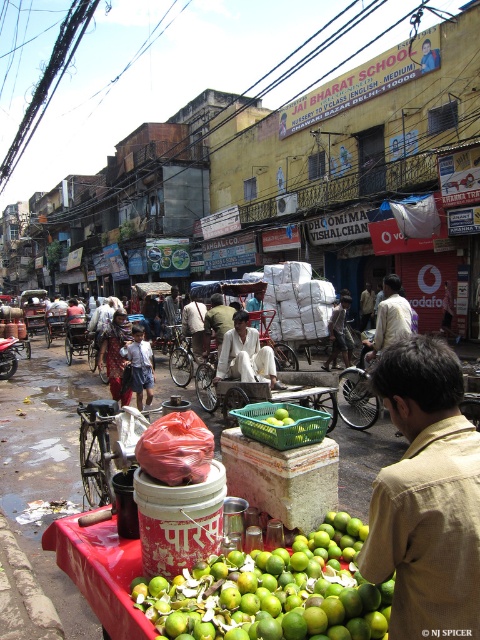
You are a delivery person trying to reach the plastic red cart at center to pick up a package. There is a person wearing light brown cotton pants at center in your way. Can you walk around them to reach the cart?

The light brown cotton pants at center has a lesser height compared to plastic red cart at center, so you can walk around the person wearing light brown cotton pants at center since they are shorter than the cart. However, you should still be cautious of their presence and ensure safe passage around them.

You are a delivery person trying to navigate through the street. You see the light brown cotton pants at center and the plastic red cart at center. Which object is closer to your right side?

The light brown cotton pants at center is positioned on the right side of plastic red cart at center, so it is closer to your right side.

You are a street vendor trying to organize your stall. You have a light brown cotton pants at center and a green plastic basket at center. Which item should you move if you want to create space for a new display of limes? Please explain your reasoning based on their sizes.

The light brown cotton pants at center is taller than the green plastic basket at center. Since the pants take up more vertical space, moving them would create more space for the new lime display.